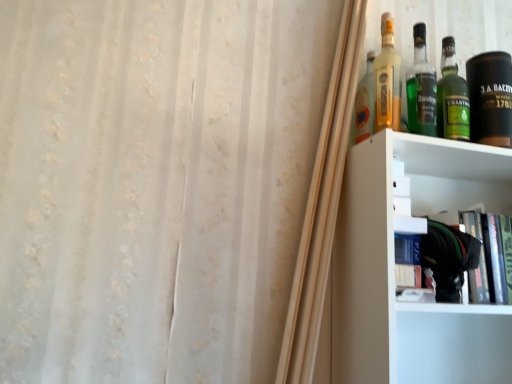
Question: Is green glass bottle at upper right, the 3th bottle from the left, inside or outside of hardcover book at upper right?

Choices:
 (A) outside
 (B) inside

Answer: (A)

Question: In the image, is green glass bottle at upper right, the second bottle from the right, positioned in front of or behind hardcover book at upper right?

Choices:
 (A) front
 (B) behind

Answer: (B)

Question: Estimate the real-world distances between objects in this image. Which object is farther from the translucent glass bottle at upper right, marked as the 3th bottle in a right-to-left arrangement?

Choices:
 (A) green glass bottle at upper right, the first bottle viewed from the right
 (B) green glass bottle at upper right, the second bottle from the right
 (C) hardcover book at upper right
 (D) translucent glass bottle at upper right, which ranks as the 1th bottle in left-to-right order
 (E) black leather canister at upper right

Answer: (C)

Question: Estimate the real-world distances between objects in this image. Which object is farther from the black leather canister at upper right?

Choices:
 (A) translucent glass bottle at upper right, the 2th bottle positioned from the left
 (B) green glass bottle at upper right, acting as the 4th bottle starting from the left
 (C) translucent glass bottle at upper right, which ranks as the 1th bottle in left-to-right order
 (D) green glass bottle at upper right, the 3th bottle from the left
 (E) hardcover book at upper right

Answer: (E)